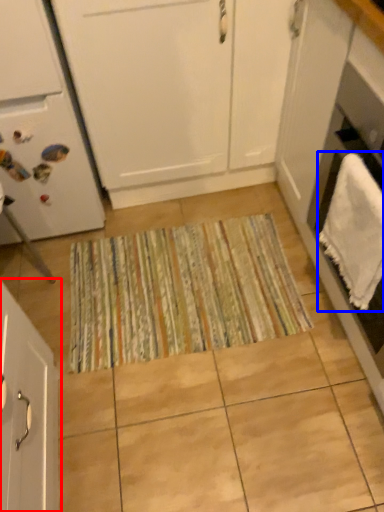
Question: Which of the following is the farthest to the observer, cabinetry (highlighted by a red box) or bath towel (highlighted by a blue box)?

Choices:
 (A) cabinetry
 (B) bath towel

Answer: (B)